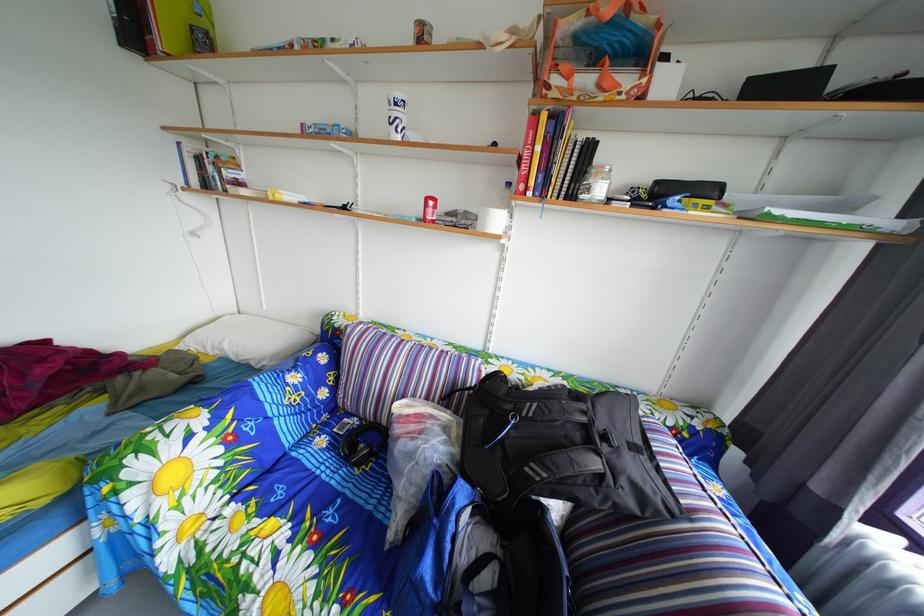
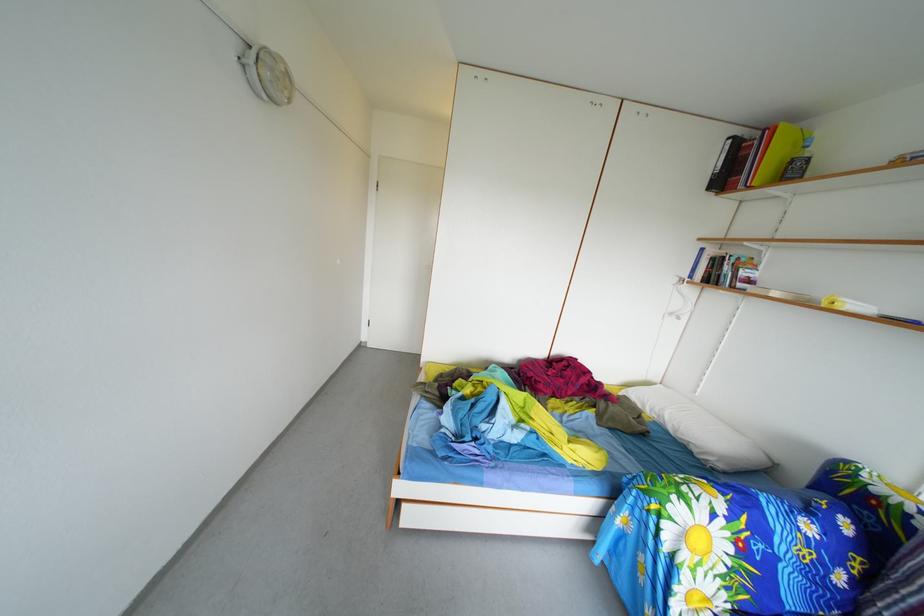
Question: The camera is either moving clockwise (left) or counter-clockwise (right) around the object. The first image is from the beginning of the video and the second image is from the end. Is the camera moving left or right when shooting the video?

Choices:
 (A) Left
 (B) Right

Answer: (B)